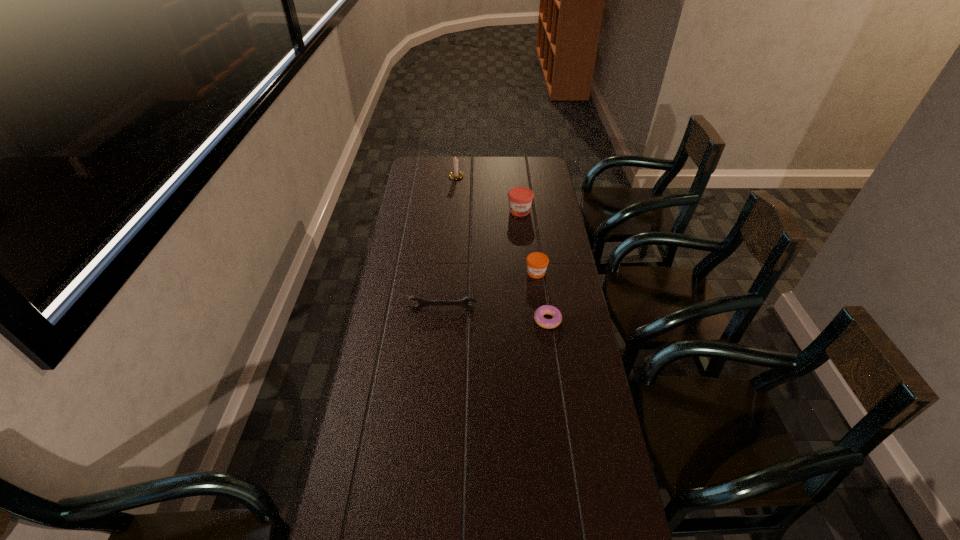
You are a GUI agent. You are given a task and a screenshot of the screen. Output one action in this format:
    pyautogui.click(x=<x>, y=<y>)
    Task: Click on the free location located 0.290m on the front label of the farther jam
    The height and width of the screenshot is (540, 960).
    Given the screenshot: What is the action you would take?
    pyautogui.click(x=525, y=260)

Find the location of a particular element. The width and height of the screenshot is (960, 540). vacant space located 0.060m on the front label of the third nearest object is located at coordinates (539, 291).

I want to click on vacant space located 0.400m on the open ends of the fourth tallest object, so click(x=434, y=409).

Find the location of a particular element. vacant region located 0.370m on the left of the shortest object is located at coordinates (430, 320).

Locate an element on the screen. object that is at the far edge is located at coordinates (455, 174).

The width and height of the screenshot is (960, 540). I want to click on object located in the left edge section of the desktop, so click(463, 302).

The height and width of the screenshot is (540, 960). I want to click on doughnut present at the right edge, so click(x=545, y=309).

Locate an element on the screen. The height and width of the screenshot is (540, 960). free space at the far edge is located at coordinates (500, 179).

I want to click on free region at the left edge of the desktop, so click(411, 406).

Locate an element on the screen. vacant space at the right edge of the desktop is located at coordinates (565, 368).